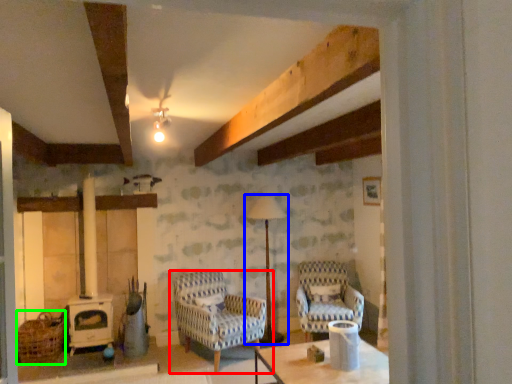
Question: Estimate the real-world distances between objects in this image. Which object is farther from chair (highlighted by a red box), lamp (highlighted by a blue box) or basket (highlighted by a green box)?

Choices:
 (A) lamp
 (B) basket

Answer: (B)